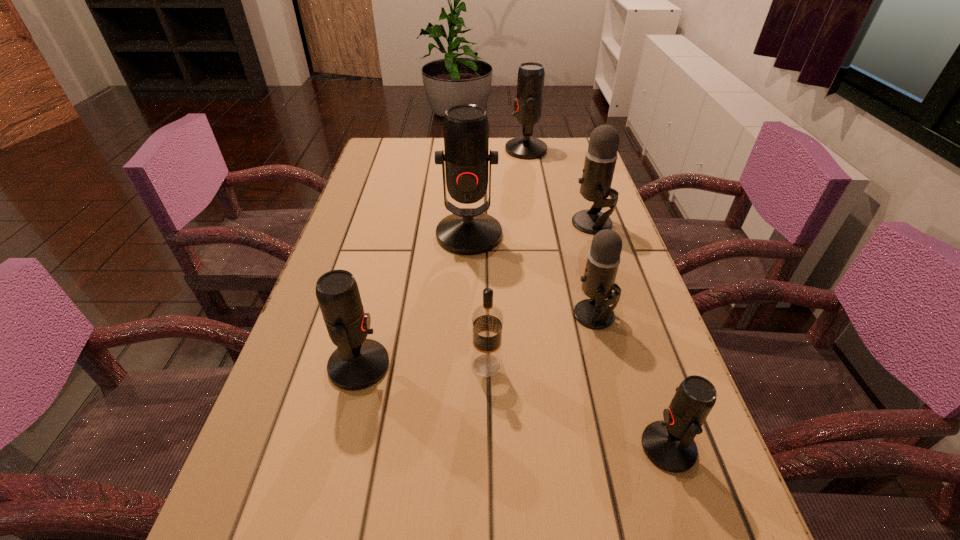
In the image, there is a desktop. Where is `blank space at the far left corner`? This screenshot has width=960, height=540. blank space at the far left corner is located at coordinates (418, 138).

You are a GUI agent. You are given a task and a screenshot of the screen. Output one action in this format:
    pyautogui.click(x=<x>, y=<y>)
    Task: Click on the blank region between the second biggest red microphone and the farther gray microphone
    This screenshot has height=540, width=960.
    Given the screenshot: What is the action you would take?
    pyautogui.click(x=559, y=186)

Find the location of a particular element. This screenshot has height=540, width=960. free space between the rightmost red microphone and the fifth farthest microphone is located at coordinates (514, 406).

Image resolution: width=960 pixels, height=540 pixels. In order to click on free area in between the tallest object and the shortest microphone in this screenshot , I will do `click(568, 341)`.

Where is `vacant space in between the third biggest red microphone and the farther gray microphone`? Image resolution: width=960 pixels, height=540 pixels. vacant space in between the third biggest red microphone and the farther gray microphone is located at coordinates pyautogui.click(x=475, y=294).

At what (x,y) coordinates should I click in order to perform the action: click on free space between the biggest red microphone and the shortest microphone. Please return your answer as a coordinate pair (x, y). Looking at the image, I should click on (568, 341).

At what (x,y) coordinates should I click in order to perform the action: click on vacant region between the nearest microphone and the bigger gray microphone. Please return your answer as a coordinate pair (x, y). The height and width of the screenshot is (540, 960). Looking at the image, I should click on (631, 335).

Locate which object ranks in proximity to the second smallest red microphone. Please provide its 2D coordinates. Your answer should be formatted as a tuple, i.e. [(x, y)], where the tuple contains the x and y coordinates of a point satisfying the conditions above.

[(487, 320)]

Image resolution: width=960 pixels, height=540 pixels. Identify the location of the fourth closest object relative to the shortest object. (468, 231).

Point out which microphone is positioned as the fourth nearest to the tallest object. Please provide its 2D coordinates. Your answer should be formatted as a tuple, i.e. [(x, y)], where the tuple contains the x and y coordinates of a point satisfying the conditions above.

[(530, 84)]